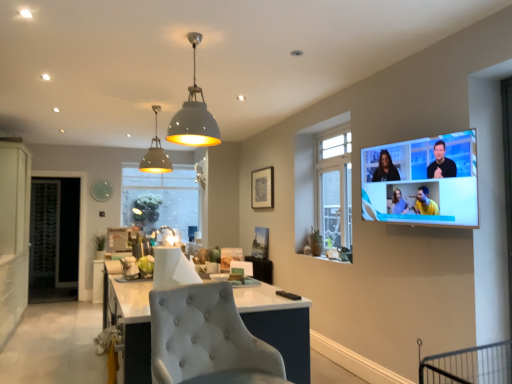
Find the location of a particular element. matte white dome at upper center is located at coordinates (194, 114).

This screenshot has height=384, width=512. What do you see at coordinates (161, 200) in the screenshot? I see `clear glass window at center, the second window from the right` at bounding box center [161, 200].

The width and height of the screenshot is (512, 384). What are the coordinates of `white matte cabinet at left` in the screenshot? It's located at (14, 233).

At what (x,y) coordinates should I click in order to perform the action: click on white tufted chair at center. Please return your answer as a coordinate pair (x, y). This screenshot has width=512, height=384. Looking at the image, I should click on (207, 339).

Measure the distance between flat screen tv at upper right and clear glass window at center, marked as the first window in a front-to-back arrangement.

The distance of flat screen tv at upper right from clear glass window at center, marked as the first window in a front-to-back arrangement, is 1.39 meters.

What's the angular difference between flat screen tv at upper right and clear glass window at center, which ranks as the second window in back-to-front order,'s facing directions?

0.4 degrees separate the facing orientations of flat screen tv at upper right and clear glass window at center, which ranks as the second window in back-to-front order.

From a real-world perspective, is flat screen tv at upper right physically below clear glass window at center, marked as the first window in a front-to-back arrangement?

Yes, from a real-world perspective, flat screen tv at upper right is under clear glass window at center, marked as the first window in a front-to-back arrangement.

Considering the relative sizes of flat screen tv at upper right and clear glass window at center, the second window positioned from the left, in the image provided, is flat screen tv at upper right wider than clear glass window at center, the second window positioned from the left,?

Yes.

Could you tell me if clear glass door at left is turned towards white matte cabinet at left?

Yes, clear glass door at left is aimed at white matte cabinet at left.

Does clear glass door at left have a lesser height compared to white matte cabinet at left?

Indeed, clear glass door at left has a lesser height compared to white matte cabinet at left.

Between clear glass door at left and white matte cabinet at left, which one appears on the left side from the viewer's perspective?

From the viewer's perspective, clear glass door at left appears more on the left side.

Which object is positioned more to the left, clear glass door at left or clear glass window at center, which is the 2th window from front to back?

→ From the viewer's perspective, clear glass door at left appears more on the left side.

Which is in front, point (56, 263) or point (170, 187)?

The point (56, 263) is closer to the camera.

Find the location of `glass door that is in front of the clear glass window at center, which ranks as the first window in back-to-front order`. glass door that is in front of the clear glass window at center, which ranks as the first window in back-to-front order is located at coordinates (54, 239).

Looking at this image, from a real-world perspective, which object stands above the other?

clear glass window at center, which is the 1th window in left-to-right order, is physically above.

Does point (247, 353) lie in front of point (156, 165)?

Yes, point (247, 353) is closer to viewer.

Considering the sizes of white tufted chair at center and matte gray pendant light at upper center in the image, is white tufted chair at center taller or shorter than matte gray pendant light at upper center?

Clearly, white tufted chair at center is shorter compared to matte gray pendant light at upper center.

Could you tell me if white tufted chair at center is turned towards matte gray pendant light at upper center?

No, white tufted chair at center is not oriented towards matte gray pendant light at upper center.

Is there a large distance between white tufted chair at center and matte gray pendant light at upper center?

white tufted chair at center is far away from matte gray pendant light at upper center.

From a real-world perspective, is clear glass door at left physically above matte black picture frame at upper center?

No, from a real-world perspective, clear glass door at left is not above matte black picture frame at upper center.

Considering the points (32, 233) and (256, 207), which point is in front, point (32, 233) or point (256, 207)?

The point (256, 207) is closer.

Considering the sizes of objects clear glass door at left and matte black picture frame at upper center in the image provided, who is taller, clear glass door at left or matte black picture frame at upper center?

Standing taller between the two is clear glass door at left.

Based on the photo, from a real-world perspective, is matte gray pendant light at upper center positioned above or below matte white dome at upper center?

matte gray pendant light at upper center is above matte white dome at upper center.

Which is correct: matte gray pendant light at upper center is inside matte white dome at upper center, or outside of it?

matte gray pendant light at upper center is not inside matte white dome at upper center, it's outside.

Which of these two, matte gray pendant light at upper center or matte white dome at upper center, is bigger?

matte white dome at upper center is bigger.

From the image's perspective, who appears lower, clear glass door at left or clear glass window at center, which ranks as the second window in back-to-front order?

clear glass door at left.

Is clear glass window at center, the second window positioned from the left, at the back of clear glass door at left?

No, clear glass door at left's orientation is not away from clear glass window at center, the second window positioned from the left.

Is clear glass door at left inside the boundaries of clear glass window at center, marked as the first window in a front-to-back arrangement, or outside?

clear glass door at left is not inside clear glass window at center, marked as the first window in a front-to-back arrangement, it's outside.

The height and width of the screenshot is (384, 512). What are the coordinates of `tv show that is in front of the clear glass window at center, which is counted as the 1th window, starting from the right` in the screenshot? It's located at (422, 181).

At what (x,y) coordinates should I click in order to perform the action: click on cabinetry to the right of clear glass door at left. Please return your answer as a coordinate pair (x, y). The width and height of the screenshot is (512, 384). Looking at the image, I should click on (14, 233).

From the picture: From the image, which object appears to be farther from white matte cabinet at left, clear glass window at center, which is the 2th window from front to back, or matte gray pendant light at upper center?

clear glass window at center, which is the 2th window from front to back, is positioned further to the anchor white matte cabinet at left.

Estimate the real-world distances between objects in this image. Which object is closer to matte gray pendant light at upper center, white tufted chair at center or clear glass window at center, marked as the first window in a front-to-back arrangement?

Among the two, clear glass window at center, marked as the first window in a front-to-back arrangement, is located nearer to matte gray pendant light at upper center.

Which object lies nearer to the anchor point matte black picture frame at upper center, white tufted chair at center or matte gray pendant light at upper center?

Based on the image, matte gray pendant light at upper center appears to be nearer to matte black picture frame at upper center.

From the image, which object appears to be nearer to clear glass window at center, the second window positioned from the left, matte black picture frame at upper center or flat screen tv at upper right?

matte black picture frame at upper center is closer to clear glass window at center, the second window positioned from the left.

Based on the photo, based on their spatial positions, is matte gray pendant light at upper center or matte black picture frame at upper center closer to clear glass door at left?

The object closer to clear glass door at left is matte gray pendant light at upper center.

Which object lies nearer to the anchor point matte gray pendant light at upper center, clear glass window at center, the second window positioned from the left, or matte white dome at upper center?

Based on the image, matte white dome at upper center appears to be nearer to matte gray pendant light at upper center.

Which object lies further to the anchor point clear glass window at center, the second window from the right, white matte cabinet at left or matte gray pendant light at upper center?

Based on the image, matte gray pendant light at upper center appears to be further to clear glass window at center, the second window from the right.

Which object lies further to the anchor point clear glass door at left, clear glass window at center, which ranks as the first window in back-to-front order, or white matte cabinet at left?

white matte cabinet at left lies further to clear glass door at left than the other object.

What are the coordinates of `cabinetry positioned between flat screen tv at upper right and clear glass window at center, which ranks as the first window in back-to-front order, from near to far` in the screenshot? It's located at (14, 233).

This screenshot has height=384, width=512. I want to click on picture frame located between white matte cabinet at left and flat screen tv at upper right in the left-right direction, so click(x=262, y=188).

The width and height of the screenshot is (512, 384). I want to click on light fixture between clear glass door at left and clear glass window at center, the second window positioned from the left, so click(x=194, y=114).

The image size is (512, 384). I want to click on picture frame between white tufted chair at center and clear glass window at center, the second window from the right, in the front-back direction, so click(x=262, y=188).